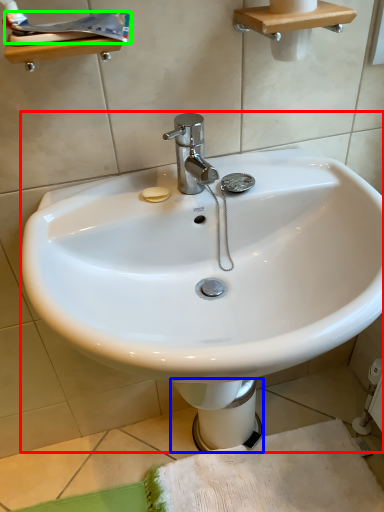
Question: Based on their relative distances, which object is farther from sink (highlighted by a red box)? Choose from bidet (highlighted by a blue box) and toothpaste (highlighted by a green box).

Choices:
 (A) bidet
 (B) toothpaste

Answer: (B)